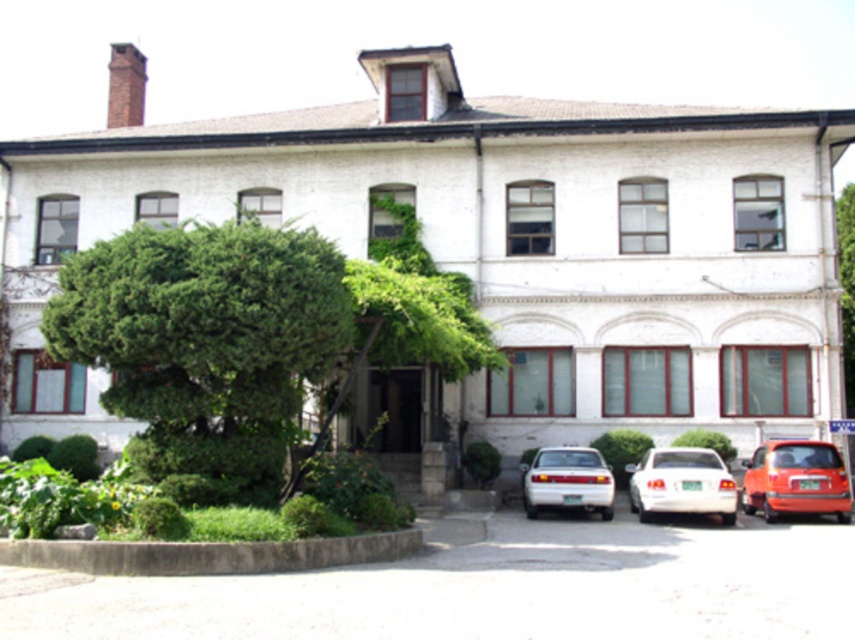
Based on the photo, you are standing in front of the two story building and want to walk from point (x=747, y=490) to point (x=603, y=513). Which direction should you move in relation to the building?

You should move towards the building because point (x=747, y=490) is closer to you than point (x=603, y=513).

Looking at this image, you are standing in front of the two story building with a white facade and red framed windows. You see a point at coordinate (814, 454). Is this point closer to you or farther away than 60 feet?

The point at coordinate (814, 454) is 59.69 feet away from the viewer, so it is closer than 60 feet.

From the picture: You are standing at the entrance of the two story building and want to walk towards the point marked as point (x=694, y=502). Will you pass by point (x=528, y=481) on your way there?

Point (x=694, y=502) is in front of point (x=528, y=481), so you will not pass by point (x=528, y=481) on your way to point (x=694, y=502).